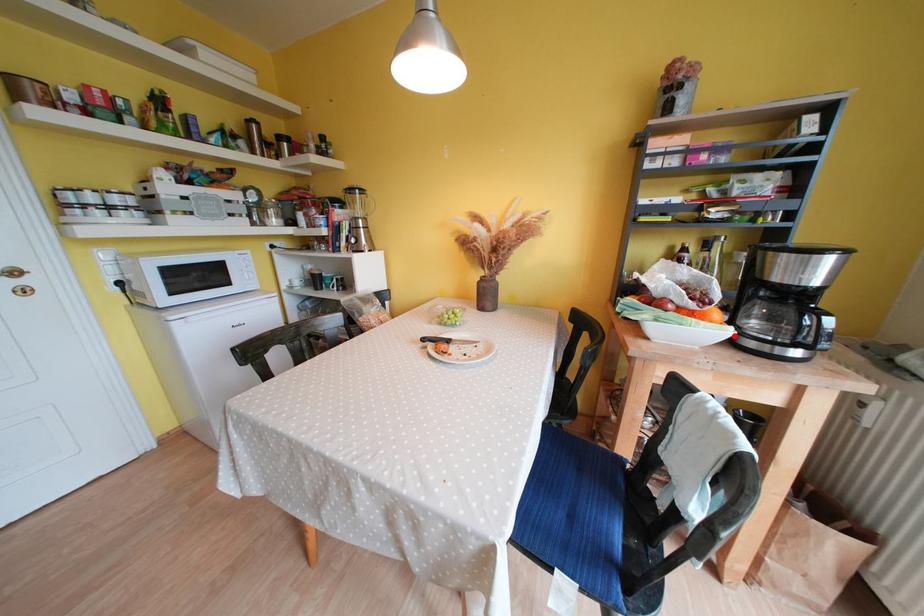
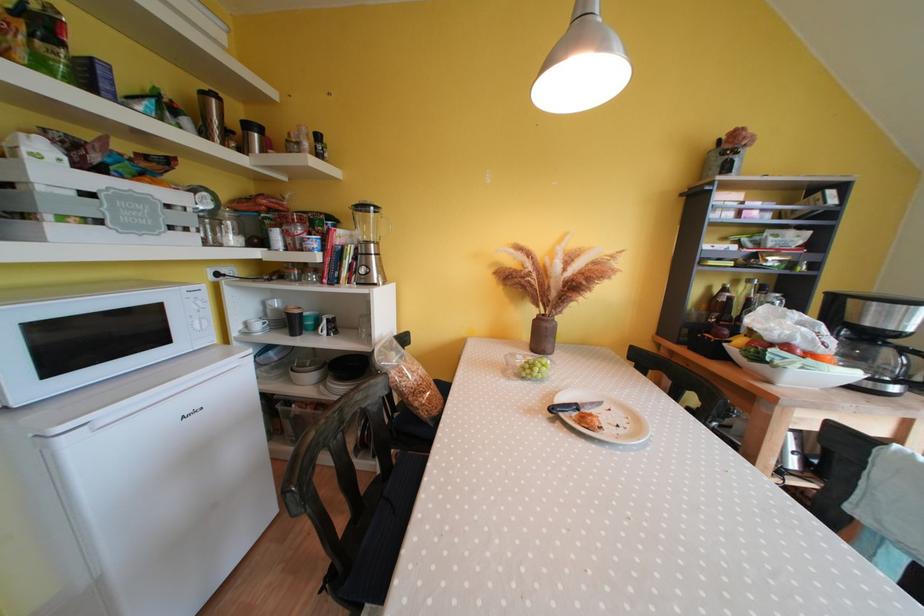
Find the pixel in the second image that matches the highlighted location in the first image.

(858, 378)